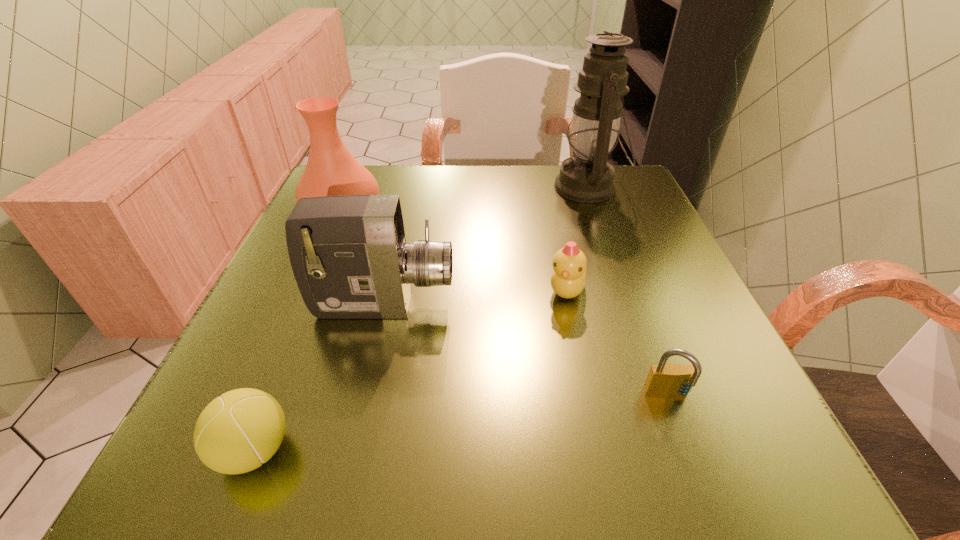
Identify the location of object at the near left corner. (237, 432).

At what (x,y) coordinates should I click in order to perform the action: click on object present at the far right corner. Please return your answer as a coordinate pair (x, y). This screenshot has height=540, width=960. Looking at the image, I should click on (587, 177).

Where is `free spot at the far edge of the desktop`? free spot at the far edge of the desktop is located at coordinates (434, 205).

Locate an element on the screen. free space at the near edge of the desktop is located at coordinates tap(338, 429).

This screenshot has height=540, width=960. I want to click on vacant region at the left edge of the desktop, so 267,352.

You are a GUI agent. You are given a task and a screenshot of the screen. Output one action in this format:
    pyautogui.click(x=<x>, y=<y>)
    Task: Click on the free space at the right edge of the desktop
    
    Given the screenshot: What is the action you would take?
    pyautogui.click(x=659, y=316)

Find the location of a particular element. Image resolution: width=960 pixels, height=540 pixels. vacant space at the far right corner is located at coordinates (619, 188).

The height and width of the screenshot is (540, 960). In order to click on vacant space at the near right corner of the desktop in this screenshot , I will do `click(770, 468)`.

Find the location of a particular element. Image resolution: width=960 pixels, height=540 pixels. unoccupied position between the fifth shortest object and the duckling is located at coordinates (454, 252).

The width and height of the screenshot is (960, 540). What are the coordinates of `unoccupied area between the second tallest object and the tennis ball` in the screenshot? It's located at (299, 332).